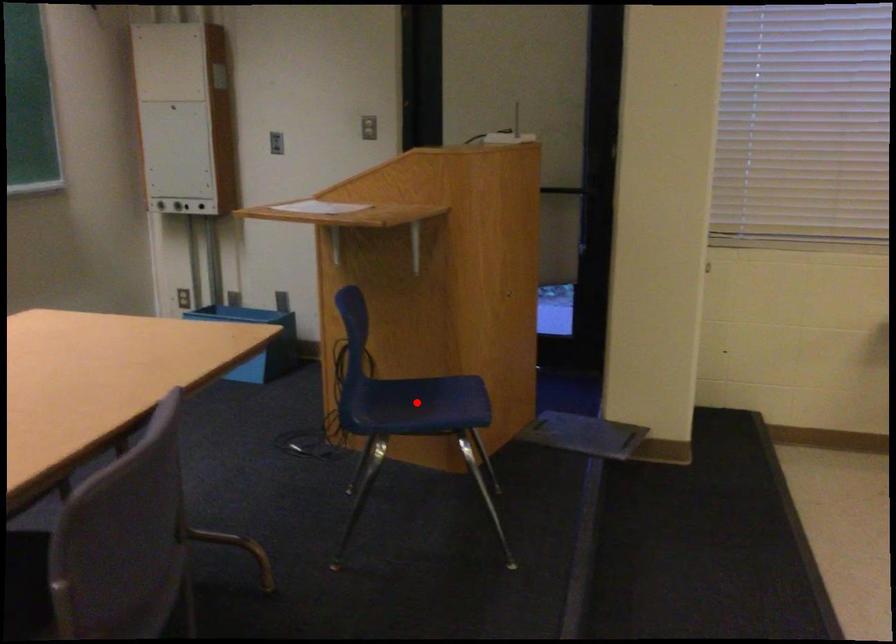
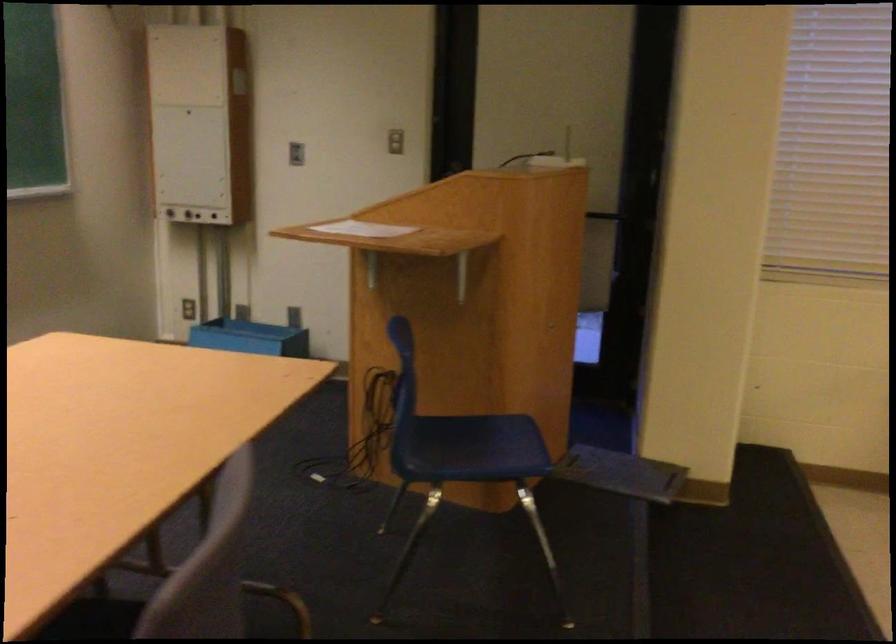
Locate, in the second image, the point that corresponds to the highlighted location in the first image.

(466, 442)